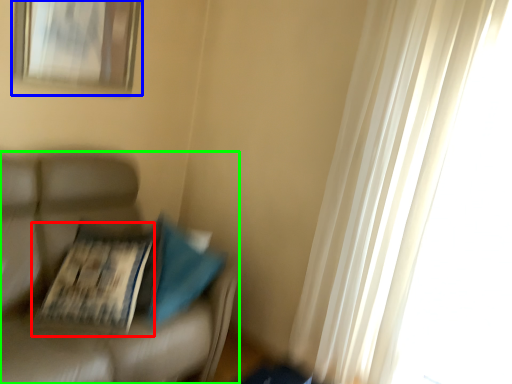
Question: Based on their relative distances, which object is farther from magazine (highlighted by a red box)? Choose from picture frame (highlighted by a blue box) and furniture (highlighted by a green box).

Choices:
 (A) picture frame
 (B) furniture

Answer: (A)